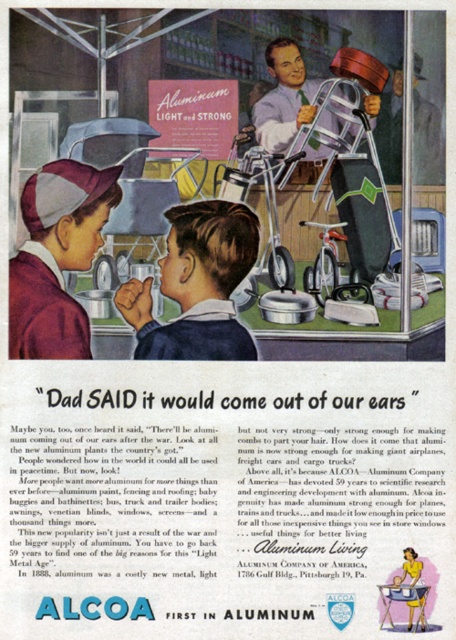
At what (x,y) coordinates should I click in order to perform the action: click on maroon fabric baseball cap at center-left. Please return your answer as a coordinate pair (x, y). The image size is (456, 640). Looking at the image, I should click on (57, 257).

Is point (81, 216) closer to camera compared to point (383, 96)?

Yes.

Which is in front, point (57, 214) or point (440, 176)?

Point (57, 214) is more forward.

I want to click on maroon fabric baseball cap at center-left, so click(57, 257).

Which is below, maroon fabric baseball cap at center-left or matte aluminum helmet at upper center?

maroon fabric baseball cap at center-left

Is maroon fabric baseball cap at center-left further to camera compared to matte aluminum helmet at upper center?

No.

This screenshot has width=456, height=640. Identify the location of maroon fabric baseball cap at center-left. (57, 257).

Find the location of `maroon fabric baseball cap at center-left`. maroon fabric baseball cap at center-left is located at coordinates (57, 257).

Can you confirm if dark brown hair at center is positioned to the left of matte aluminum helmet at upper center?

Correct, you'll find dark brown hair at center to the left of matte aluminum helmet at upper center.

Between dark brown hair at center and matte aluminum helmet at upper center, which one has less height?

Standing shorter between the two is matte aluminum helmet at upper center.

Where is `dark brown hair at center`? This screenshot has height=640, width=456. dark brown hair at center is located at coordinates (196, 284).

The width and height of the screenshot is (456, 640). Find the location of `dark brown hair at center`. dark brown hair at center is located at coordinates (196, 284).